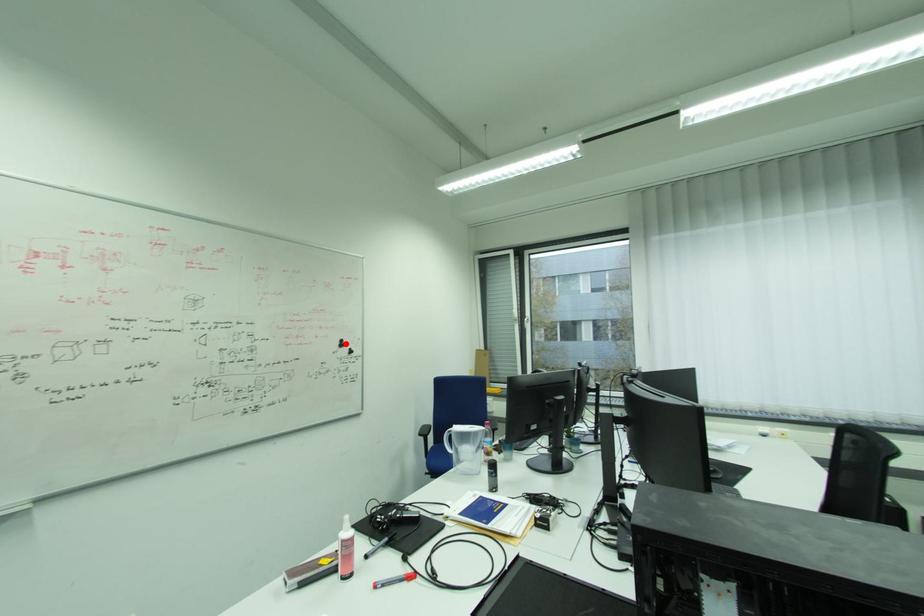
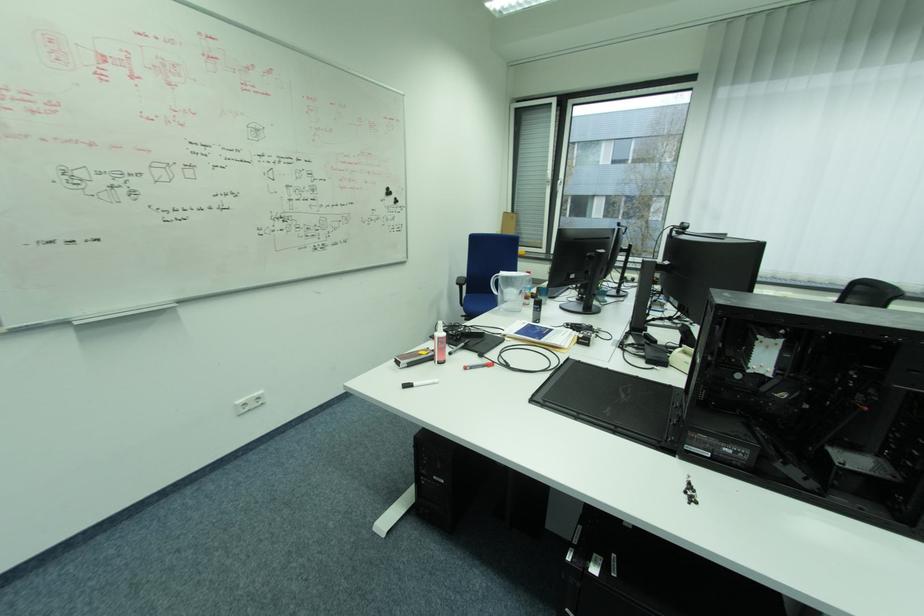
The point at the highlighted location is marked in the first image. Where is the corresponding point in the second image?

(392, 192)